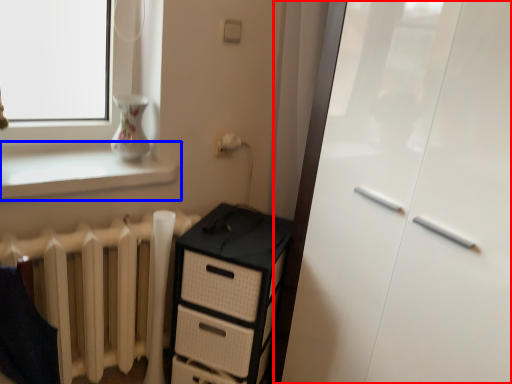
Question: Which object is further to the camera taking this photo, screen door (highlighted by a red box) or window sill (highlighted by a blue box)?

Choices:
 (A) screen door
 (B) window sill

Answer: (B)